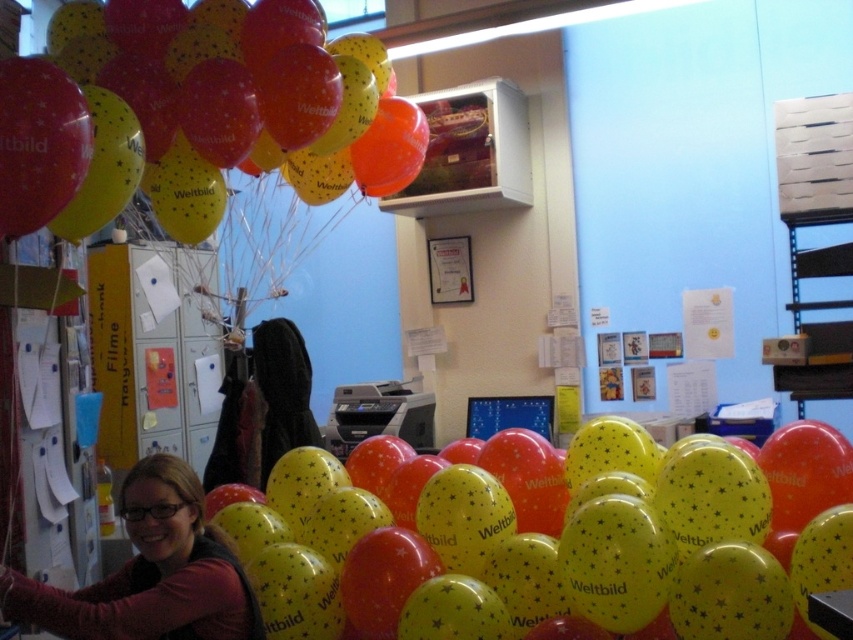
Question: Can you confirm if matte yellow balloon at upper left is positioned above matte black sweater at lower left?

Choices:
 (A) yes
 (B) no

Answer: (A)

Question: Which point is farther to the camera?

Choices:
 (A) matte black sweater at lower left
 (B) matte yellow balloon at upper left
 (C) yellow glossy balloon at center

Answer: (C)

Question: Is yellow glossy balloon at center behind matte yellow balloon at upper left?

Choices:
 (A) no
 (B) yes

Answer: (B)

Question: Which object is the farthest from the matte yellow balloon at upper left?

Choices:
 (A) yellow glossy balloon at center
 (B) matte black sweater at lower left

Answer: (A)

Question: Estimate the real-world distances between objects in this image. Which object is closer to the yellow glossy balloon at center?

Choices:
 (A) matte black sweater at lower left
 (B) matte yellow balloon at upper left

Answer: (A)

Question: Can you confirm if yellow glossy balloon at center is bigger than matte yellow balloon at upper left?

Choices:
 (A) no
 (B) yes

Answer: (B)